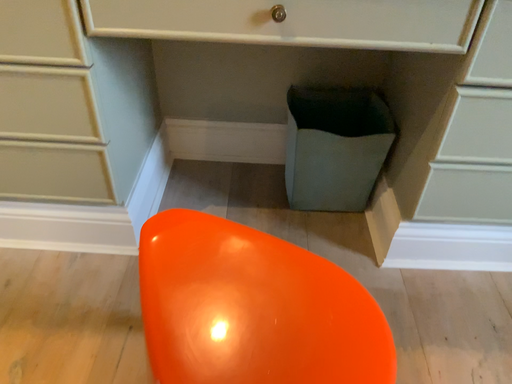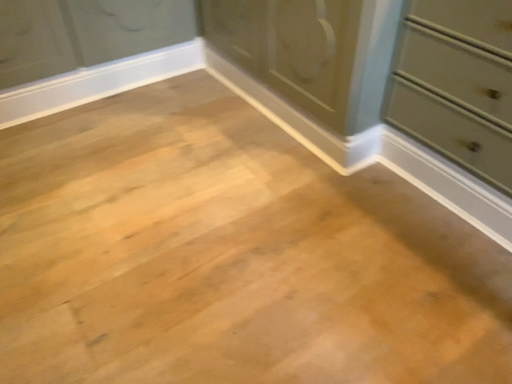
Question: How did the camera likely rotate when shooting the video?

Choices:
 (A) rotated downward
 (B) rotated upward

Answer: (B)